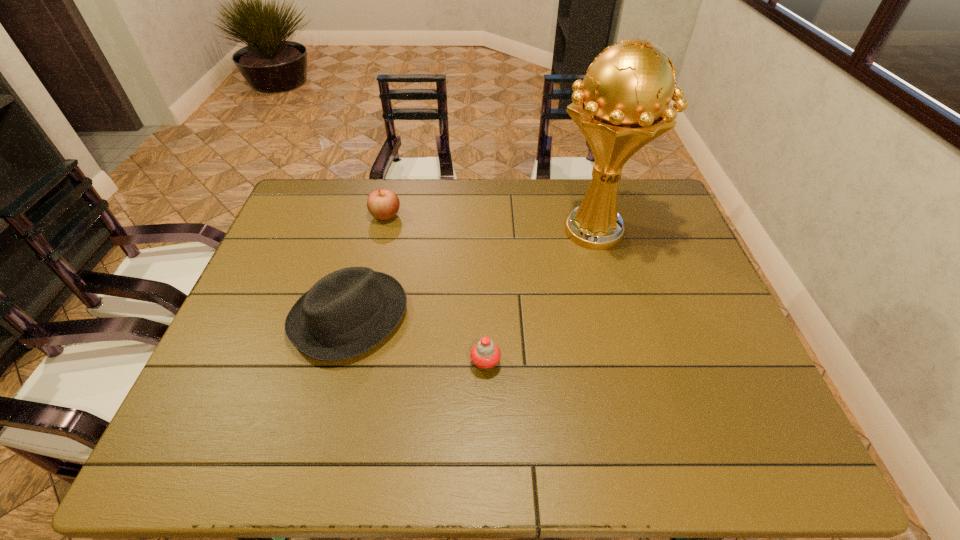
In order to click on apple that is at the far edge in this screenshot , I will do `click(383, 204)`.

Locate an element on the screen. object that is at the left edge is located at coordinates (347, 312).

Find the location of a particular element. Image resolution: width=960 pixels, height=540 pixels. object situated at the right edge is located at coordinates coord(623,103).

You are a GUI agent. You are given a task and a screenshot of the screen. Output one action in this format:
    pyautogui.click(x=<x>, y=<y>)
    Task: Click on the object positioned at the far right corner
    This screenshot has height=540, width=960.
    Given the screenshot: What is the action you would take?
    pyautogui.click(x=623, y=103)

This screenshot has height=540, width=960. In the image, there is a desktop. Find the location of `free region at the far edge`. free region at the far edge is located at coordinates (414, 217).

Where is `free region at the near edge`? free region at the near edge is located at coordinates (611, 437).

In the image, there is a desktop. At what (x,y) coordinates should I click in order to perform the action: click on vacant region at the left edge. Please return your answer as a coordinate pair (x, y). The image size is (960, 540). Looking at the image, I should click on (276, 299).

The width and height of the screenshot is (960, 540). I want to click on vacant space at the right edge of the desktop, so click(677, 249).

I want to click on empty space between the apple and the fedora, so click(368, 266).

Where is `free area in between the trophy_cup and the cupcake`? free area in between the trophy_cup and the cupcake is located at coordinates (540, 298).